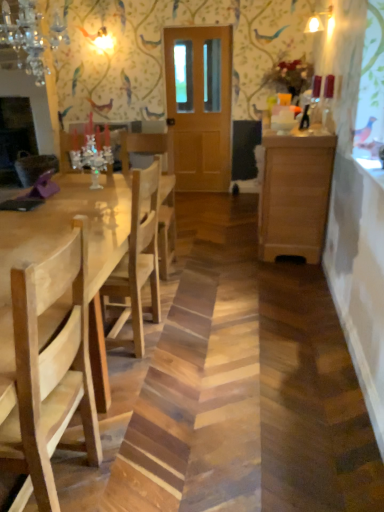
Measure the distance between point (33, 247) and camera.

Point (33, 247) and camera are 2.00 meters apart from each other.

Image resolution: width=384 pixels, height=512 pixels. What do you see at coordinates (295, 193) in the screenshot?
I see `wooden cabinet at right` at bounding box center [295, 193].

Identify the location of crystal glass chandelier at upper left. (31, 37).

Find the location of a particular element. The width and height of the screenshot is (384, 512). natural wood chair at left is located at coordinates (49, 372).

In order to face natural wood chair at left, should I rotate leftwards or rightwards?

You should look left and rotate roughly 22.401 degrees.

Measure the distance between point (x=204, y=98) and camera.

Point (x=204, y=98) and camera are 5.34 meters apart.

The width and height of the screenshot is (384, 512). Find the location of `natural wood table at left`. natural wood table at left is located at coordinates (61, 243).

Which is more to the left, crystal glass chandelier at upper left or wooden cabinet at right?

crystal glass chandelier at upper left is more to the left.

From a real-world perspective, is crystal glass chandelier at upper left on top of wooden cabinet at right?

Correct, in the physical world, crystal glass chandelier at upper left is higher than wooden cabinet at right.

Is wooden cabinet at right at the back of crystal glass chandelier at upper left?

No, wooden cabinet at right is not at the back of crystal glass chandelier at upper left.

From the image's perspective, which one is positioned higher, crystal glass chandelier at upper left or wooden cabinet at right?

crystal glass chandelier at upper left, from the image's perspective.

Is natural wood table at left bigger or smaller than wooden door at center?

Considering their sizes, natural wood table at left takes up more space than wooden door at center.

Is natural wood table at left not near wooden door at center?

That's right, there is a large distance between natural wood table at left and wooden door at center.

Does natural wood table at left appear on the left side of wooden door at center?

Yes, natural wood table at left is to the left of wooden door at center.

Is wooden door at center surrounded by natural wood table at left?

No, wooden door at center is located outside of natural wood table at left.

Is crystal glass chandelier at upper left outside of natural wood table at left?

crystal glass chandelier at upper left lies outside natural wood table at left's area.

Does crystal glass chandelier at upper left lie in front of natural wood table at left?

No, crystal glass chandelier at upper left is behind natural wood table at left.

Locate an element on the screen. This screenshot has width=384, height=512. kitchen & dining room table below the natural wood chair at left (from a real-world perspective) is located at coordinates (61, 243).

How many degrees apart are the facing directions of natural wood table at left and natural wood chair at left?

They differ by 5.11 degrees in their facing directions.

Does point (61, 222) appear closer or farther from the camera than point (39, 360)?

Clearly, point (61, 222) is more distant from the camera than point (39, 360).

Is natural wood table at left located outside natural wood chair at left?

Absolutely, natural wood table at left is external to natural wood chair at left.

From a real-world perspective, is natural wood chair at left positioned over crystal glass chandelier at upper left based on gravity?

Actually, natural wood chair at left is physically below crystal glass chandelier at upper left in the real world.

Considering the positions of point (9, 462) and point (34, 13), is point (9, 462) closer or farther from the camera than point (34, 13)?

Point (9, 462) is positioned closer to the camera compared to point (34, 13).

Can you confirm if natural wood chair at left is thinner than crystal glass chandelier at upper left?

Incorrect, the width of natural wood chair at left is not less than that of crystal glass chandelier at upper left.

Is natural wood chair at left beside crystal glass chandelier at upper left?

There is a gap between natural wood chair at left and crystal glass chandelier at upper left.

From the image's perspective, is natural wood chair at left under wooden cabinet at right?

Yes.

Is natural wood chair at left positioned with its back to wooden cabinet at right?

natural wood chair at left does not have its back to wooden cabinet at right.

Identify the location of chair that appears above the wooden cabinet at right (from a real-world perspective). (49, 372).

In terms of size, does crystal glass chandelier at upper left appear bigger or smaller than natural wood chair at left?

Considering their sizes, crystal glass chandelier at upper left takes up less space than natural wood chair at left.

Which point is more forward, (21, 19) or (29, 345)?

The point (29, 345) is more forward.

Is crystal glass chandelier at upper left facing away from natural wood chair at left?

No, crystal glass chandelier at upper left's orientation is not away from natural wood chair at left.

This screenshot has height=512, width=384. I want to click on light fixture on the left of wooden cabinet at right, so click(31, 37).

Where is `door that appears above the natural wood table at left (from the image's perspective)`? This screenshot has height=512, width=384. door that appears above the natural wood table at left (from the image's perspective) is located at coordinates (200, 105).

Based on their spatial positions, is crystal glass chandelier at upper left or natural wood chair at left further from wooden cabinet at right?

natural wood chair at left lies further to wooden cabinet at right than the other object.

Based on the photo, based on their spatial positions, is natural wood table at left or wooden cabinet at right closer to crystal glass chandelier at upper left?

The object closer to crystal glass chandelier at upper left is natural wood table at left.

Looking at the image, which one is located further to natural wood table at left, crystal glass chandelier at upper left or wooden cabinet at right?

Among the two, crystal glass chandelier at upper left is located further to natural wood table at left.

Which object lies nearer to the anchor point wooden door at center, natural wood table at left or natural wood chair at left?

The object closer to wooden door at center is natural wood table at left.

Looking at the image, which one is located closer to wooden door at center, wooden cabinet at right or natural wood table at left?

wooden cabinet at right.

Considering their positions, is natural wood chair at left positioned closer to natural wood table at left than wooden door at center?

Based on the image, natural wood chair at left appears to be nearer to natural wood table at left.

From the image, which object appears to be farther from natural wood chair at left, wooden door at center or crystal glass chandelier at upper left?

wooden door at center is positioned further to the anchor natural wood chair at left.

Which object lies further to the anchor point wooden door at center, natural wood table at left or crystal glass chandelier at upper left?

The object further to wooden door at center is natural wood table at left.

At what (x,y) coordinates should I click in order to perform the action: click on cabinetry between natural wood table at left and wooden door at center along the z-axis. Please return your answer as a coordinate pair (x, y). The image size is (384, 512). Looking at the image, I should click on (295, 193).

At what (x,y) coordinates should I click in order to perform the action: click on cabinetry between crystal glass chandelier at upper left and wooden door at center in the front-back direction. Please return your answer as a coordinate pair (x, y). The width and height of the screenshot is (384, 512). Looking at the image, I should click on click(x=295, y=193).

You are a GUI agent. You are given a task and a screenshot of the screen. Output one action in this format:
    pyautogui.click(x=<x>, y=<y>)
    Task: Click on the kitchen & dining room table located between natural wood chair at left and wooden cabinet at right in the depth direction
    
    Given the screenshot: What is the action you would take?
    point(61,243)

In order to click on light fixture positioned between natural wood chair at left and wooden door at center from near to far in this screenshot , I will do `click(31, 37)`.